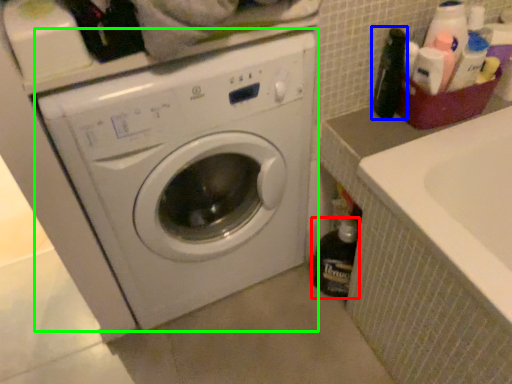
Question: Considering the real-world distances, which object is farthest from bottle (highlighted by a red box)? bottle (highlighted by a blue box) or washing machine (highlighted by a green box)?

Choices:
 (A) bottle
 (B) washing machine

Answer: (A)